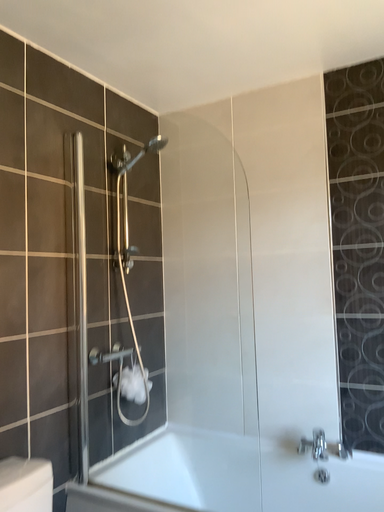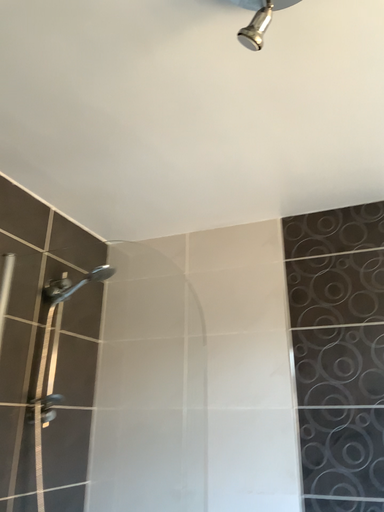
Question: How did the camera likely rotate when shooting the video?

Choices:
 (A) rotated left
 (B) rotated right

Answer: (B)